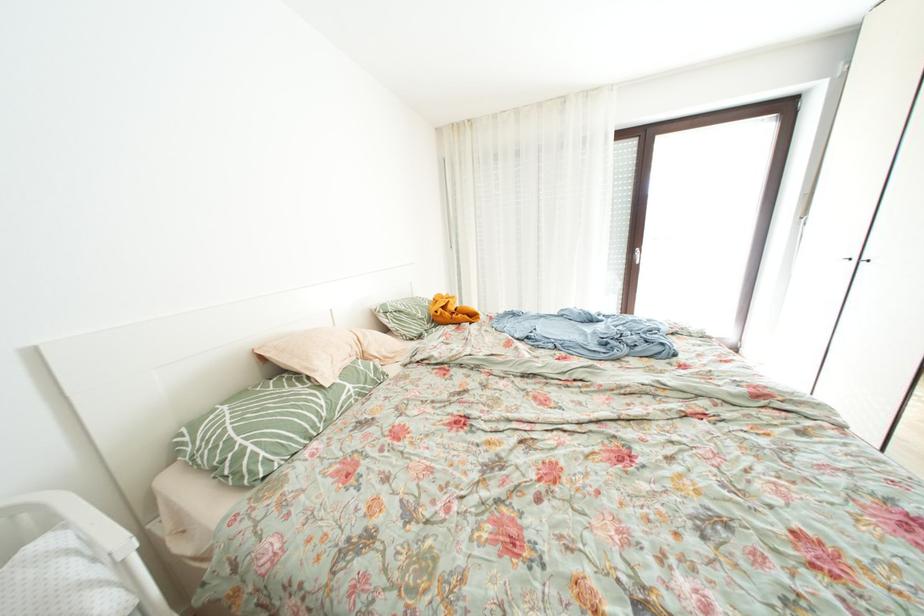
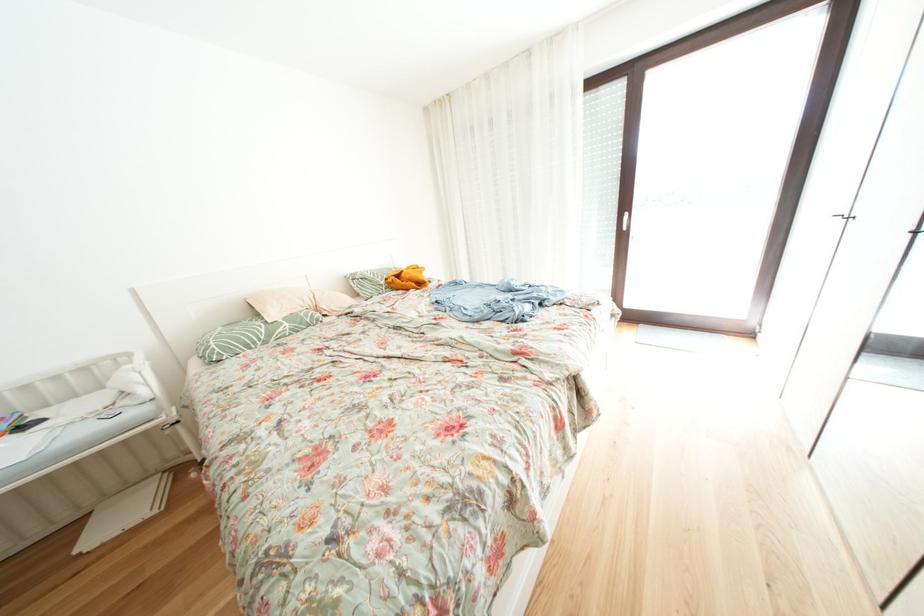
The point at (359,391) is marked in the first image. Where is the corresponding point in the second image?

(296, 329)